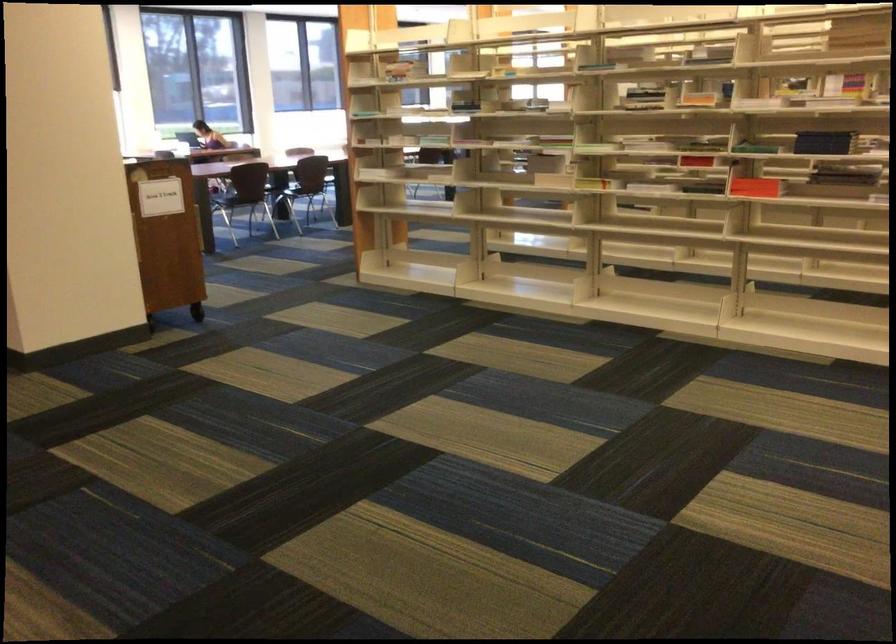
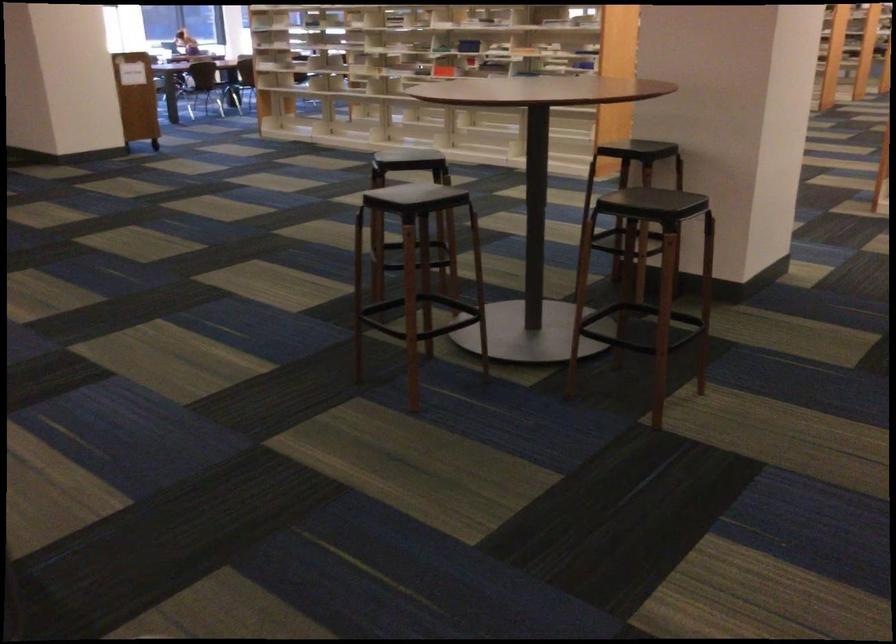
In the second image, find the point that corresponds to pixel 812 254 in the first image.

(443, 71)